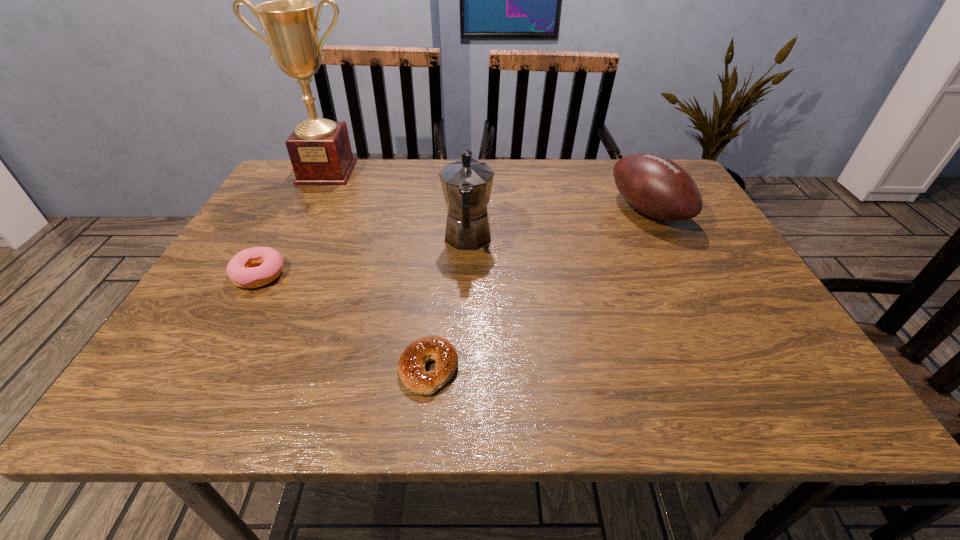
You are a GUI agent. You are given a task and a screenshot of the screen. Output one action in this format:
    pyautogui.click(x=<x>, y=<y>)
    Task: Click on the trophy cup
    
    Given the screenshot: What is the action you would take?
    pyautogui.click(x=320, y=151)

Locate an element on the screen. The width and height of the screenshot is (960, 540). the tallest object is located at coordinates (320, 151).

Identify the location of the second tallest object. (467, 183).

The height and width of the screenshot is (540, 960). Identify the location of the third shortest object. (655, 186).

Identify the location of football (American). This screenshot has height=540, width=960. (655, 186).

Identify the location of doughnut. (240, 269).

The image size is (960, 540). I want to click on bagel, so click(411, 366).

At what (x,y) coordinates should I click in order to perform the action: click on the shortest object. Please return your answer as a coordinate pair (x, y). Looking at the image, I should click on (411, 366).

At what (x,y) coordinates should I click in order to perform the action: click on free spot located 0.240m on the plaque of the trophy cup. Please return your answer as a coordinate pair (x, y). This screenshot has width=960, height=540. Looking at the image, I should click on (294, 236).

You are a GUI agent. You are given a task and a screenshot of the screen. Output one action in this format:
    pyautogui.click(x=<x>, y=<y>)
    Task: Click on the vacant space located on the pouring side of the second tallest object
    
    Given the screenshot: What is the action you would take?
    pyautogui.click(x=469, y=184)